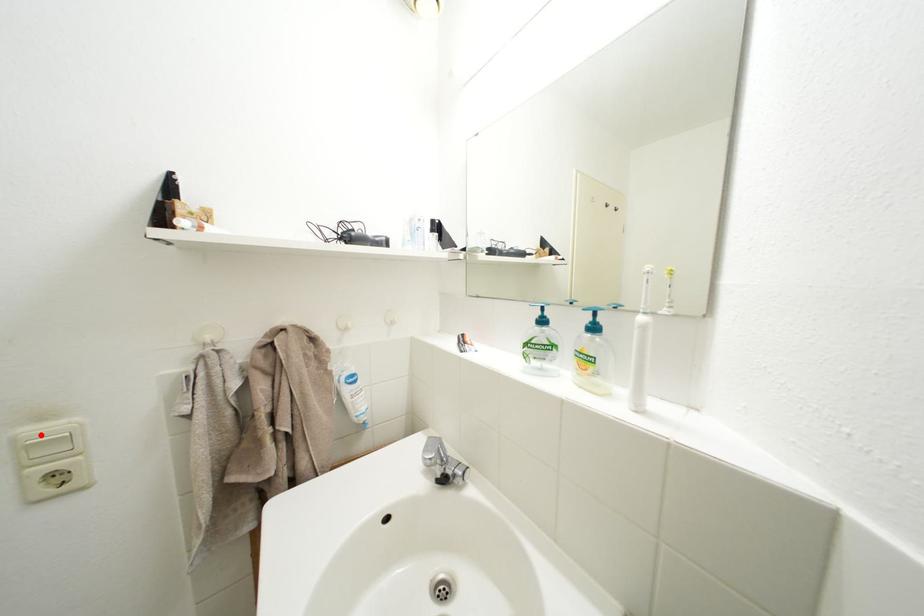
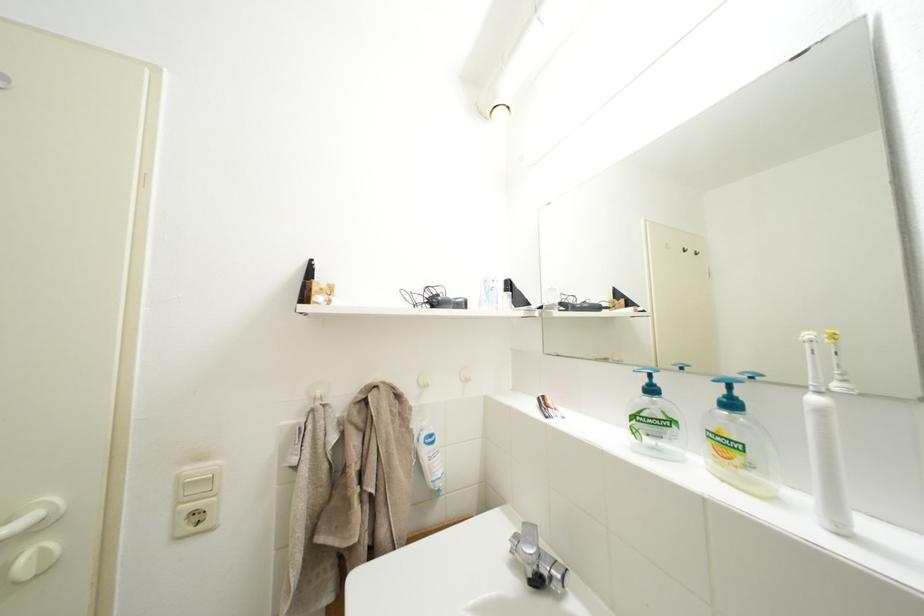
In the second image, find the point that corresponds to the highlighted location in the first image.

(200, 475)